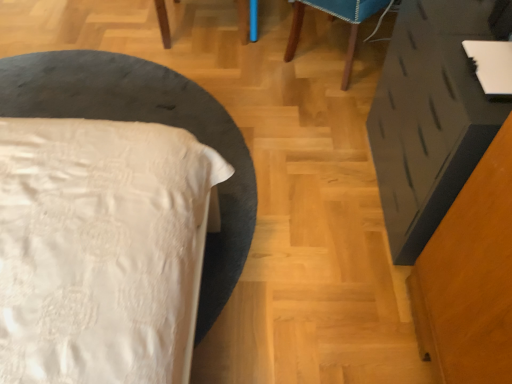
Question: Would you say white satin bed at left is outside matte black vanity at right?

Choices:
 (A) yes
 (B) no

Answer: (A)

Question: Could you tell me if white satin bed at left is facing matte black vanity at right?

Choices:
 (A) no
 (B) yes

Answer: (A)

Question: Is white satin bed at left at the left side of matte black vanity at right?

Choices:
 (A) yes
 (B) no

Answer: (A)

Question: Is the position of white satin bed at left less distant than that of matte black vanity at right?

Choices:
 (A) no
 (B) yes

Answer: (A)

Question: Is white satin bed at left turned away from matte black vanity at right?

Choices:
 (A) no
 (B) yes

Answer: (A)

Question: Does white satin bed at left appear on the right side of matte black vanity at right?

Choices:
 (A) yes
 (B) no

Answer: (B)

Question: Could wooden chair at upper center be considered to be inside matte black vanity at right?

Choices:
 (A) yes
 (B) no

Answer: (B)

Question: Can you confirm if matte black vanity at right is thinner than wooden chair at upper center?

Choices:
 (A) no
 (B) yes

Answer: (B)

Question: Would you say matte black vanity at right is a long distance from wooden chair at upper center?

Choices:
 (A) no
 (B) yes

Answer: (A)

Question: Does matte black vanity at right appear on the right side of wooden chair at upper center?

Choices:
 (A) yes
 (B) no

Answer: (A)

Question: Could you tell me if matte black vanity at right is turned towards wooden chair at upper center?

Choices:
 (A) yes
 (B) no

Answer: (B)

Question: Does matte black vanity at right have a greater width compared to wooden chair at upper center?

Choices:
 (A) no
 (B) yes

Answer: (A)

Question: From a real-world perspective, is wooden chair at upper center located beneath matte black vanity at right?

Choices:
 (A) no
 (B) yes

Answer: (B)